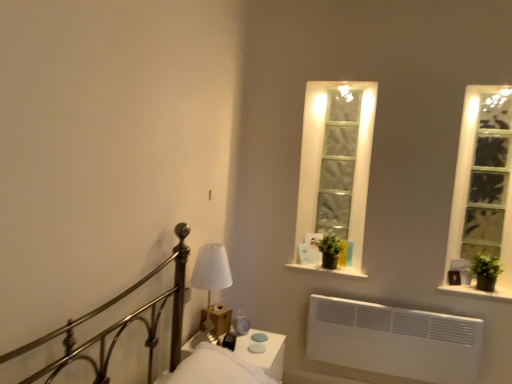
Where is `free spot below green matte plant at center, the first plant positioned from the back (from a real-world perspective)`? Image resolution: width=512 pixels, height=384 pixels. free spot below green matte plant at center, the first plant positioned from the back (from a real-world perspective) is located at coordinates (330, 273).